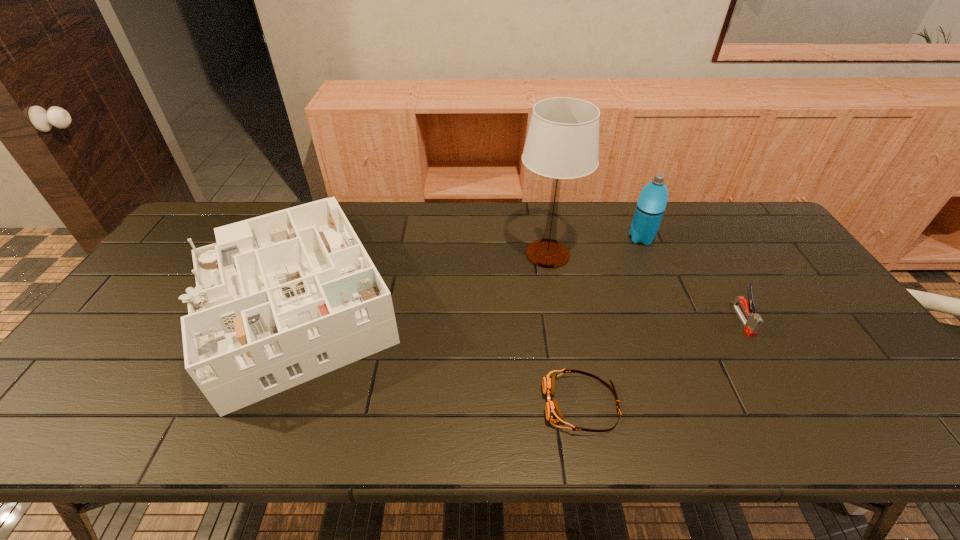
The image size is (960, 540). In order to click on free space between the goggles and the leftmost object in this screenshot , I will do `click(435, 352)`.

The height and width of the screenshot is (540, 960). Find the location of `vacant space that's between the goggles and the leftmost object`. vacant space that's between the goggles and the leftmost object is located at coordinates (435, 352).

Where is `empty space between the tallest object and the shortest object`? The height and width of the screenshot is (540, 960). empty space between the tallest object and the shortest object is located at coordinates (564, 329).

Where is `vacant space that is in between the stapler and the goggles`? This screenshot has height=540, width=960. vacant space that is in between the stapler and the goggles is located at coordinates (661, 362).

The width and height of the screenshot is (960, 540). What are the coordinates of `empty location between the third shortest object and the goggles` in the screenshot? It's located at (435, 352).

Locate an element on the screen. This screenshot has width=960, height=540. vacant area that lies between the tallest object and the dollhouse is located at coordinates (419, 276).

Where is `vacant space in between the second object from right to left and the tallest object`? vacant space in between the second object from right to left and the tallest object is located at coordinates (594, 246).

Find the location of `the second closest object to the stapler`. the second closest object to the stapler is located at coordinates (562, 142).

Choose which object is the third nearest neighbor to the table lamp. Please provide its 2D coordinates. Your answer should be formatted as a tuple, i.e. [(x, y)], where the tuple contains the x and y coordinates of a point satisfying the conditions above.

[(553, 413)]

You are a GUI agent. You are given a task and a screenshot of the screen. Output one action in this format:
    pyautogui.click(x=<x>, y=<y>)
    Task: Click on the blank area in the image that satisfies the following two spatial constraints: 1. on the back side of the third tallest object; 2. on the left side of the fourth shortest object
    The height and width of the screenshot is (540, 960).
    Given the screenshot: What is the action you would take?
    (x=316, y=238)